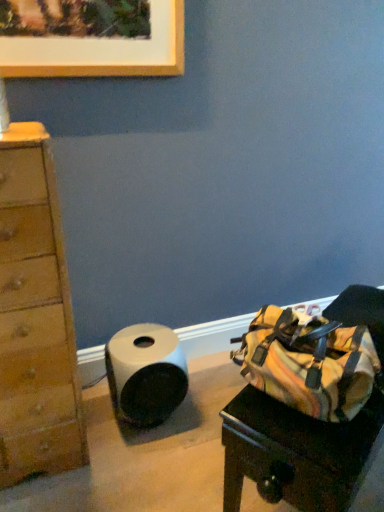
In order to click on free space in front of white matte paper towel at lower left in this screenshot , I will do `click(139, 467)`.